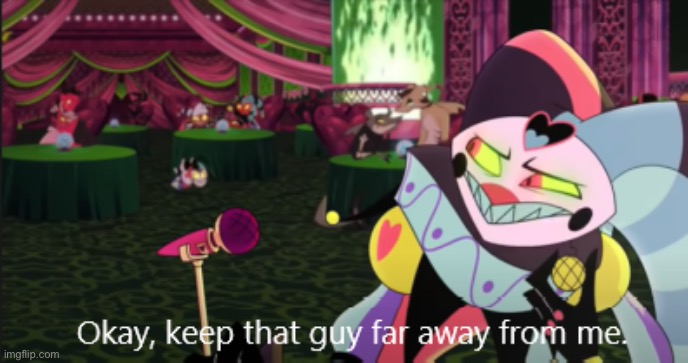
Find the location of a particular element. carpet is located at coordinates (270, 197).